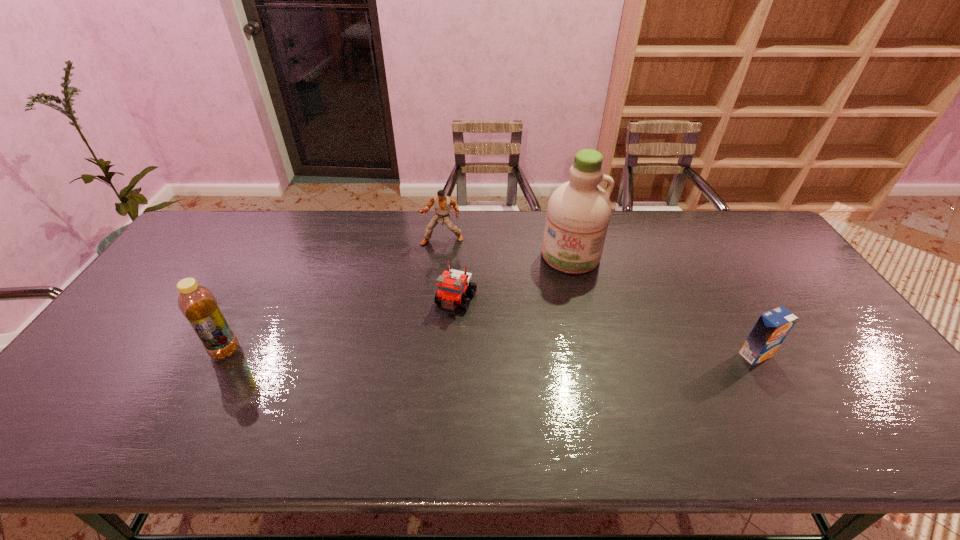
In order to click on free spot between the cleansing agent and the bottle in this screenshot , I will do `click(398, 303)`.

The width and height of the screenshot is (960, 540). Identify the location of free spot between the third nearest object and the orange_juice. (606, 327).

At what (x,y) coordinates should I click in order to perform the action: click on vacant space in between the cleansing agent and the third farthest object. Please return your answer as a coordinate pair (x, y). The height and width of the screenshot is (540, 960). Looking at the image, I should click on (514, 278).

Where is `vacant space that's between the rightmost object and the bottle`? This screenshot has height=540, width=960. vacant space that's between the rightmost object and the bottle is located at coordinates (491, 353).

Where is `vacant area that lies between the leftmost object and the shortest object`? vacant area that lies between the leftmost object and the shortest object is located at coordinates (341, 325).

Find the location of a particular element. This screenshot has width=960, height=540. empty location between the third tallest object and the fourth shortest object is located at coordinates (334, 295).

This screenshot has height=540, width=960. Find the location of `object that is the nearest to the second shortest object`. object that is the nearest to the second shortest object is located at coordinates (578, 213).

Point out which object is positioned as the second nearest to the bottle. Please provide its 2D coordinates. Your answer should be formatted as a tuple, i.e. [(x, y)], where the tuple contains the x and y coordinates of a point satisfying the conditions above.

[(443, 203)]

The width and height of the screenshot is (960, 540). What are the coordinates of `free location that satisfies the following two spatial constraints: 1. on the back side of the bottle; 2. on the right side of the puncher` in the screenshot? It's located at (285, 240).

Locate an element on the screen. The height and width of the screenshot is (540, 960). free location that satisfies the following two spatial constraints: 1. on the front side of the orange_juice; 2. on the left side of the Lego is located at coordinates (453, 355).